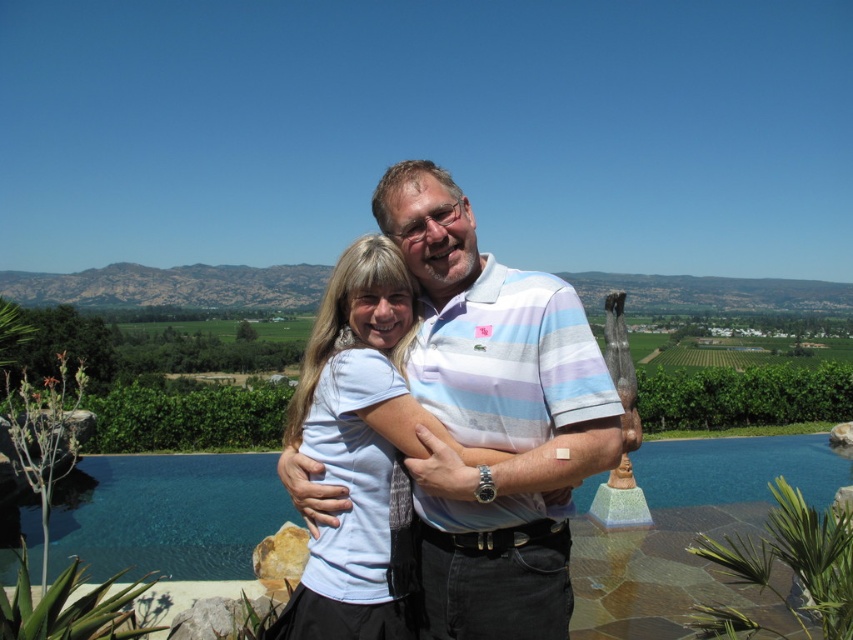
You are standing in a park and see a person wearing a white cotton shirt at center. If you want to throw a frisbee to them, and the frisbee can travel 12 meters, will it reach them?

The distance between the white cotton shirt at center and the viewer is 13.26 meters, which is farther than the frisbee can travel 12 meters. So the frisbee won not reach them.

You are a photographer trying to capture a clear photo of both the white cotton shirt at center and the white matte shirt at center. Since they are both white, you need to adjust your camera to focus on the one that is closer. Which shirt should you focus on to ensure it is in sharp focus?

The white cotton shirt at center is positioned over white matte shirt at center, so focusing on the white cotton shirt at center will ensure it is in sharp focus since it is closer to the camera.

You are a photographer trying to capture a portrait of both the white cotton shirt at center and the white matte shirt at center. Since you want to ensure both subjects are fully visible in the frame, which shirt should you position closer to the camera to avoid one blocking the other?

The white cotton shirt at center is much taller than the white matte shirt at center, so you should position the white cotton shirt at center closer to the camera to prevent it from blocking the shorter one.